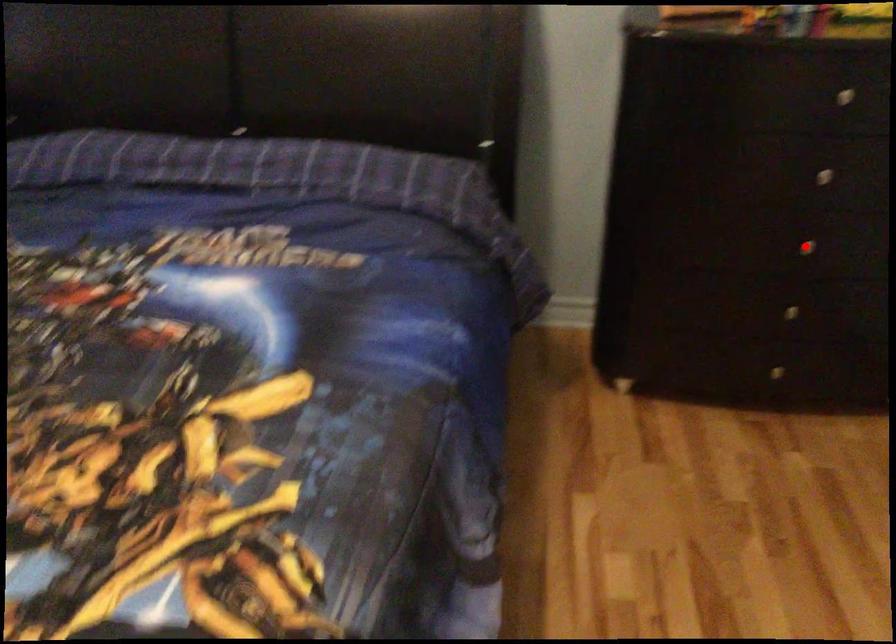
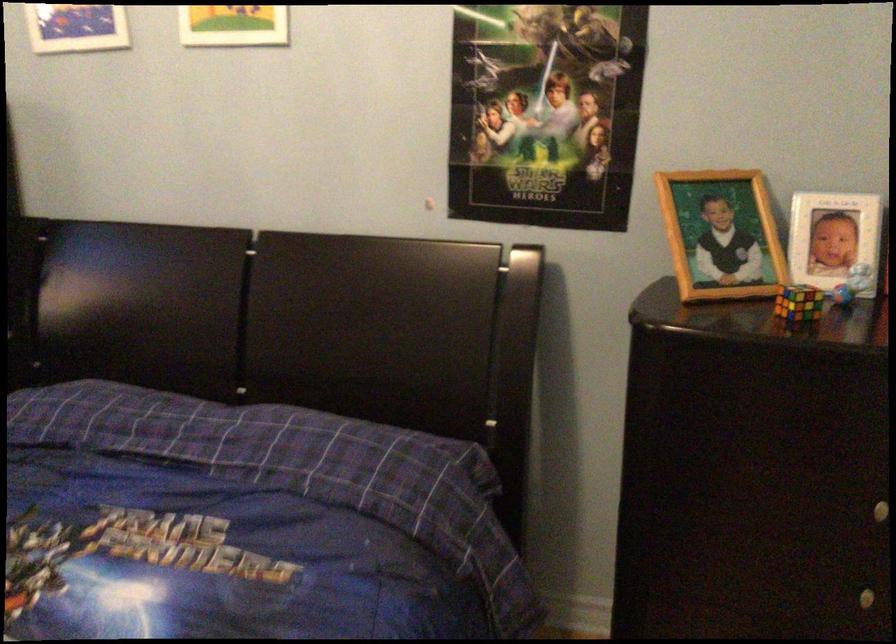
Locate, in the second image, the point that corresponds to the highlighted location in the first image.

(868, 597)